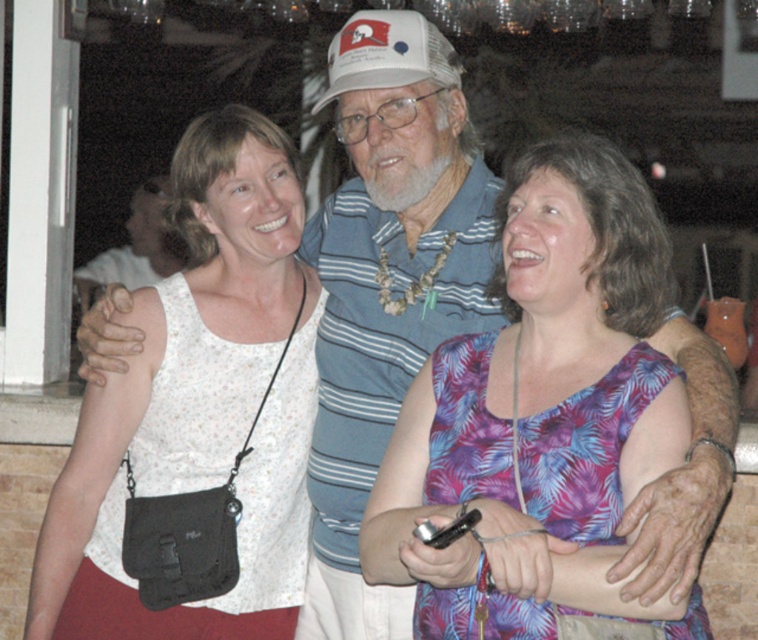
Is white fabric tank top at center wider than white mesh baseball cap at center?

Indeed, white fabric tank top at center has a greater width compared to white mesh baseball cap at center.

How much distance is there between white fabric tank top at center and white mesh baseball cap at center?

The distance of white fabric tank top at center from white mesh baseball cap at center is 68.42 centimeters.

Is point (260, 230) farther from viewer compared to point (399, 40)?

Yes, point (260, 230) is behind point (399, 40).

I want to click on white fabric tank top at center, so click(199, 406).

Consider the image. Is purple floral dress at center bigger than white fabric tank top at center?

Yes.

Who is more forward, (x=381, y=513) or (x=265, y=515)?

Positioned in front is point (x=381, y=513).

Identify the location of purple floral dress at center. (540, 419).

In the scene shown: Does purple floral dress at center appear under white mesh baseball cap at center?

Correct, purple floral dress at center is located below white mesh baseball cap at center.

This screenshot has height=640, width=758. I want to click on purple floral dress at center, so click(540, 419).